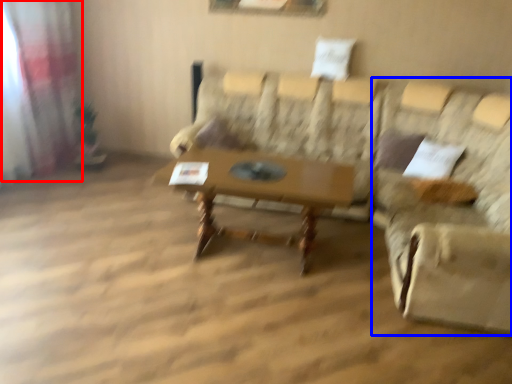
Question: Which of the following is the closest to the observer, curtain (highlighted by a red box) or swivel chair (highlighted by a blue box)?

Choices:
 (A) curtain
 (B) swivel chair

Answer: (B)